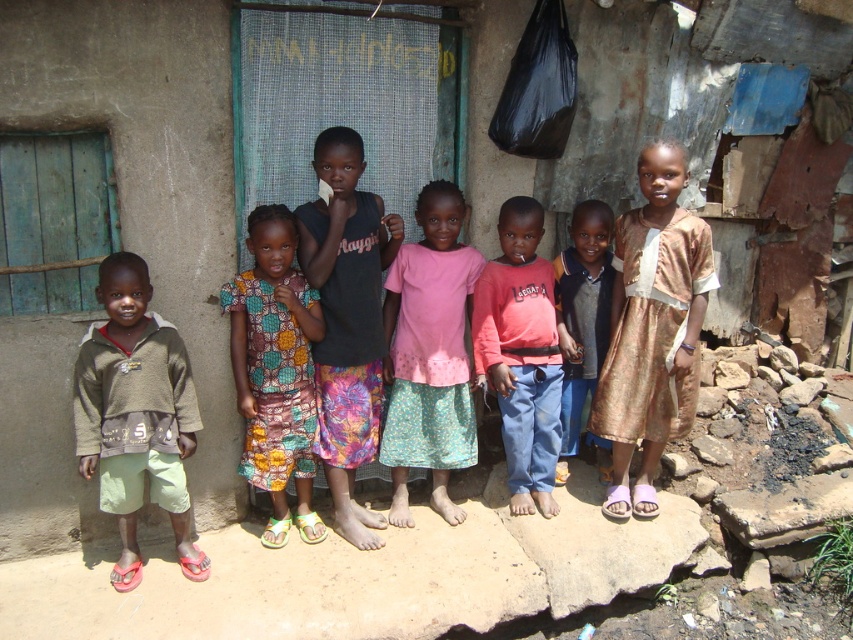
Is point (647, 368) less distant than point (322, 358)?

That is False.

Is gold brocade dress at right to the right of black cotton shirt at center from the viewer's perspective?

Indeed, gold brocade dress at right is positioned on the right side of black cotton shirt at center.

At what (x,y) coordinates should I click in order to perform the action: click on gold brocade dress at right. Please return your answer as a coordinate pair (x, y). This screenshot has width=853, height=640. Looking at the image, I should click on (653, 328).

Can you confirm if gold brocade dress at right is shorter than pink fabric dress at center?

No, gold brocade dress at right is not shorter than pink fabric dress at center.

Who is more forward, (659, 260) or (583, 340)?

Point (659, 260)

The height and width of the screenshot is (640, 853). In order to click on gold brocade dress at right in this screenshot , I will do `click(653, 328)`.

Is point (425, 417) farther from viewer compared to point (519, 342)?

No, (425, 417) is closer to viewer.

Is pink fabric skirt at center bigger than matte pink shirt at center?

Correct, pink fabric skirt at center is larger in size than matte pink shirt at center.

Who is more distant from viewer, (442, 500) or (485, 276)?

The point (442, 500) is behind.

I want to click on pink fabric skirt at center, so click(x=428, y=355).